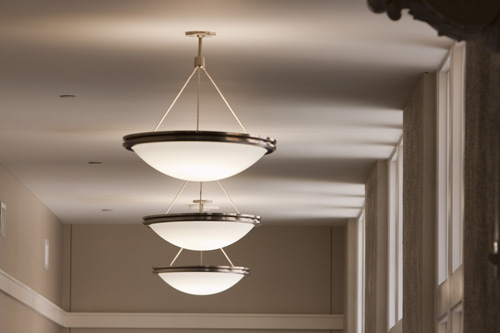
You are a GUI agent. You are given a task and a screenshot of the screen. Output one action in this format:
    pyautogui.click(x=<x>, y=<y>)
    Task: Click on the ceiling
    This screenshot has height=333, width=500.
    Given the screenshot: What is the action you would take?
    pyautogui.click(x=286, y=33)